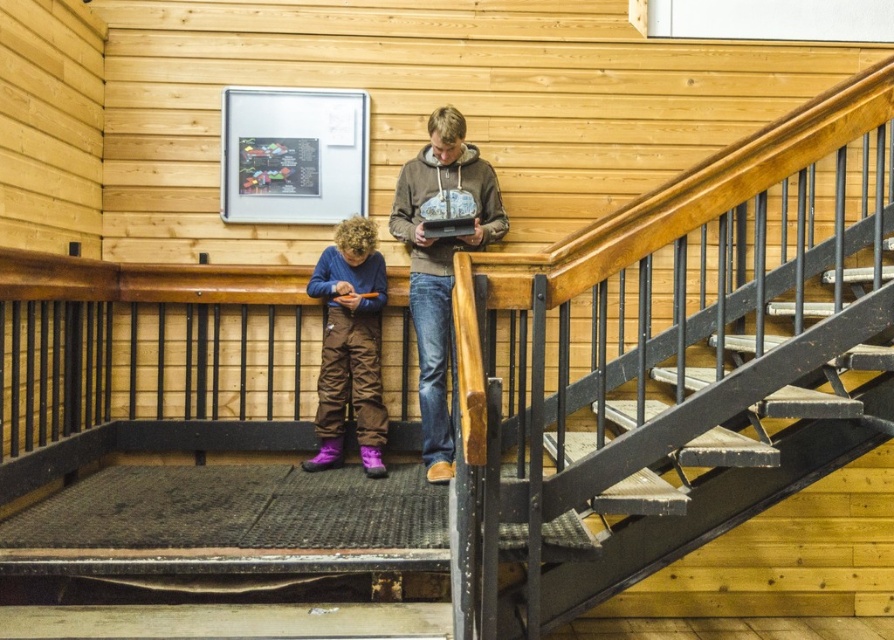
You are standing at the bottom of the staircase and see both the matte brown hoodie at center and the purple quilted snowsuit at center. Which one is nearer to you?

The matte brown hoodie at center is closer to the viewer than the purple quilted snowsuit at center, so the matte brown hoodie at center is nearer to you.

You are a tailor measuring two coats in the image. The matte brown hoodie at center and the purple quilted snowsuit at center. Which coat has a greater width for the tailor to consider?

The matte brown hoodie at center has a greater width than the purple quilted snowsuit at center according to the description.